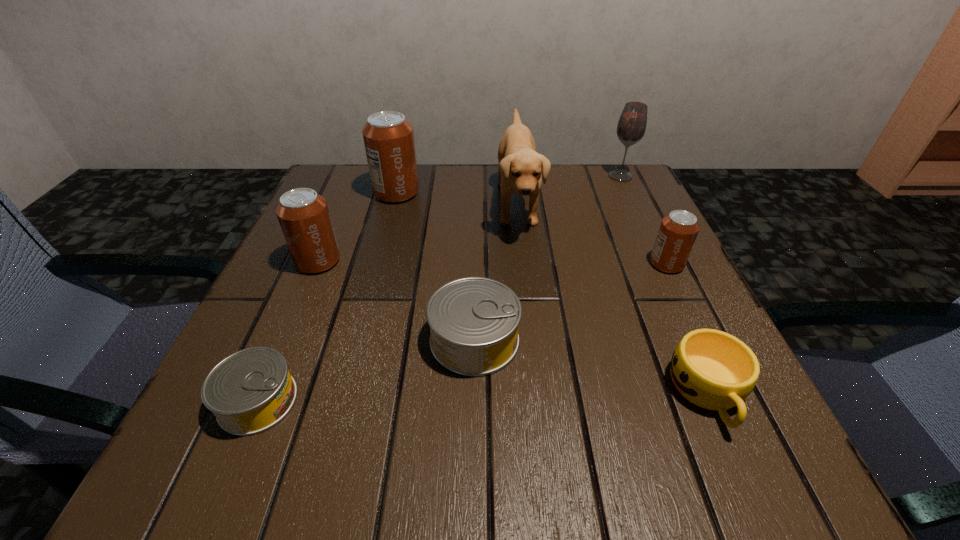
Locate an element on the screen. Image resolution: width=960 pixels, height=540 pixels. cup is located at coordinates (712, 369).

The image size is (960, 540). I want to click on the smaller silver can, so click(250, 391).

Find the location of a particular element. This screenshot has width=960, height=540. the left silver can is located at coordinates (250, 391).

Identify the location of vacant space situated on the left side of the beige puppy. Image resolution: width=960 pixels, height=540 pixels. (368, 203).

The width and height of the screenshot is (960, 540). In order to click on free space located 0.080m on the left side of the beige puppy in this screenshot , I will do `click(460, 203)`.

Find the location of a particular element. The image size is (960, 540). free space located 0.310m on the left side of the beige puppy is located at coordinates (359, 203).

Locate an element on the screen. This screenshot has width=960, height=540. vacant area situated on the right of the farthest can is located at coordinates (441, 193).

You are a GUI agent. You are given a task and a screenshot of the screen. Output one action in this format:
    pyautogui.click(x=<x>, y=<y>)
    Task: Click on the free space located 0.100m on the front of the glass drink container
    
    Given the screenshot: What is the action you would take?
    pyautogui.click(x=634, y=205)

Where is `free region located 0.190m on the back of the second tallest can`? This screenshot has height=540, width=960. free region located 0.190m on the back of the second tallest can is located at coordinates click(x=346, y=197).

Where is `free region located 0.140m on the back of the smallest orange can`? The image size is (960, 540). free region located 0.140m on the back of the smallest orange can is located at coordinates (642, 213).